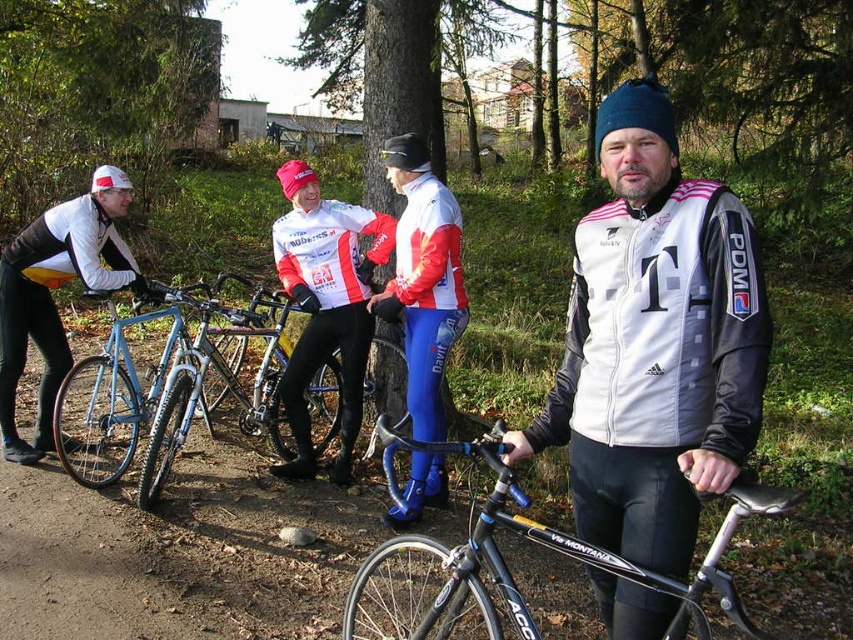
Can you confirm if matte blue cycling suit at center is smaller than shiny blue frame at center?

Yes, matte blue cycling suit at center is smaller than shiny blue frame at center.

Can you confirm if matte blue cycling suit at center is positioned below shiny blue frame at center?

No, matte blue cycling suit at center is not below shiny blue frame at center.

Where is `matte blue cycling suit at center`? This screenshot has height=640, width=853. matte blue cycling suit at center is located at coordinates (422, 280).

Is point (305, 292) positioned before point (442, 316)?

No, it is not.

Does white jersey at center have a larger size compared to matte blue cycling suit at center?

Actually, white jersey at center might be smaller than matte blue cycling suit at center.

What do you see at coordinates (325, 305) in the screenshot? I see `white jersey at center` at bounding box center [325, 305].

This screenshot has height=640, width=853. Identify the location of white jersey at center. (325, 305).

Is matte blue cycling suit at center further to camera compared to blue metallic bicycle at left?

No, matte blue cycling suit at center is in front of blue metallic bicycle at left.

This screenshot has height=640, width=853. I want to click on matte blue cycling suit at center, so click(422, 280).

Where is `matte blue cycling suit at center`? matte blue cycling suit at center is located at coordinates (422, 280).

Locate an element on the screen. The image size is (853, 640). matte blue cycling suit at center is located at coordinates (422, 280).